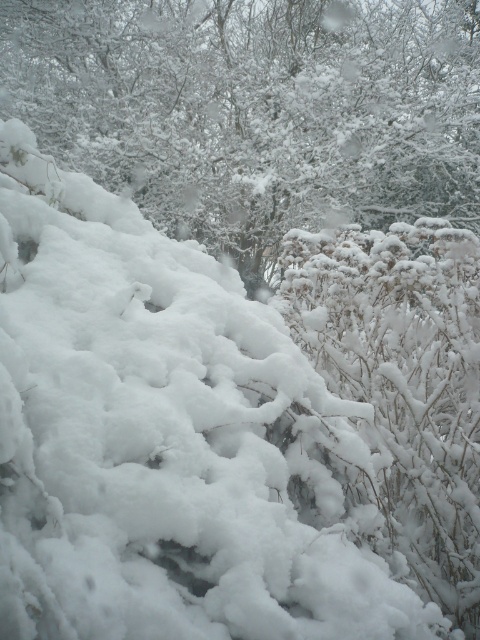
From the picture: Does white fluffy snow at center have a greater width compared to white fluffy bush at center?

Correct, the width of white fluffy snow at center exceeds that of white fluffy bush at center.

Image resolution: width=480 pixels, height=640 pixels. Identify the location of white fluffy snow at center. (255, 109).